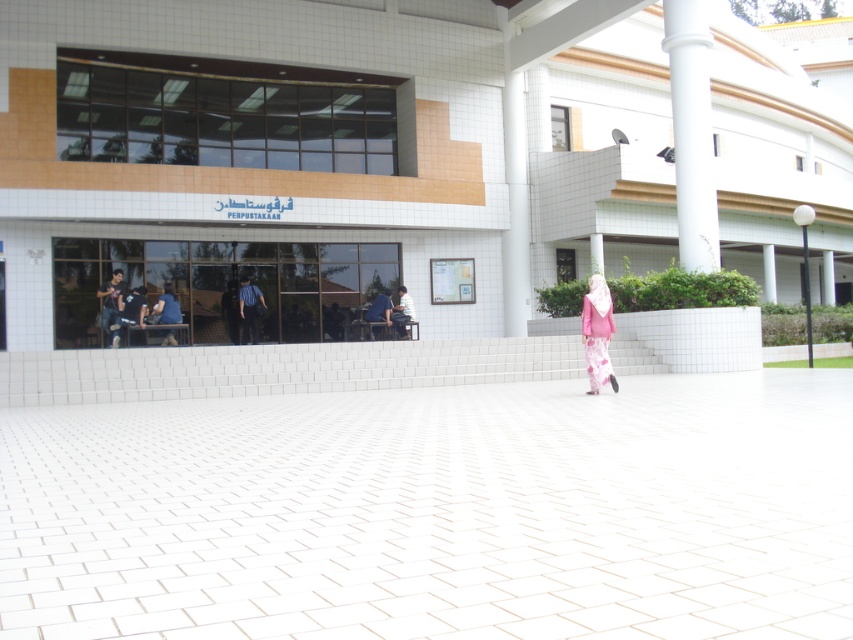
Looking at this image, you are standing in front of the library and see the white tile pavement at center and the matte black shirt at center. From your perspective, which object is positioned to the right?

The white tile pavement at center is to the right of the matte black shirt at center.

You are standing at the entrance of the library and want to walk directly to the white tile pavement at center. According to the coordinates provided, which direction should you move relative to your current position?

The white tile pavement at center is located at coordinates point [437,513], so you should move towards the right and slightly forward from your current position at the entrance.